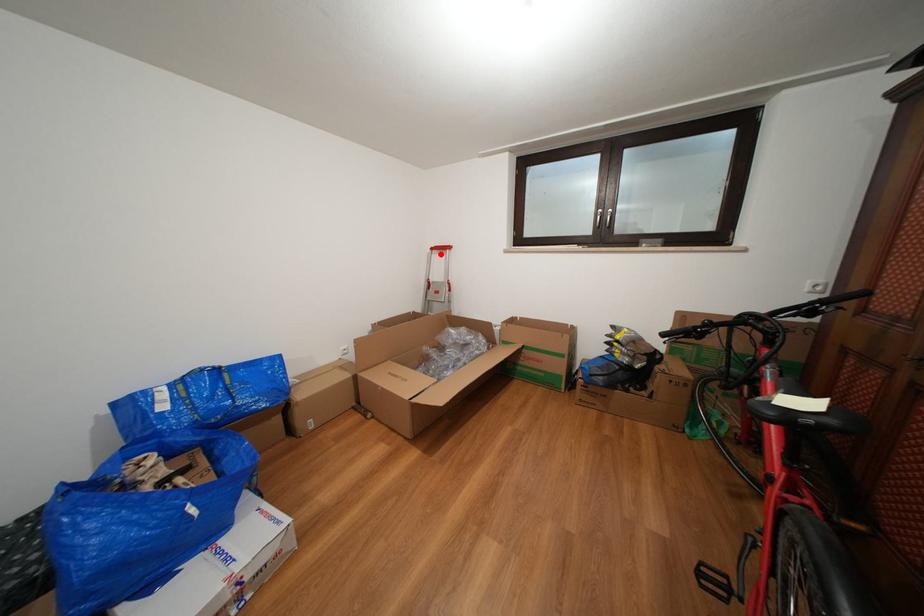
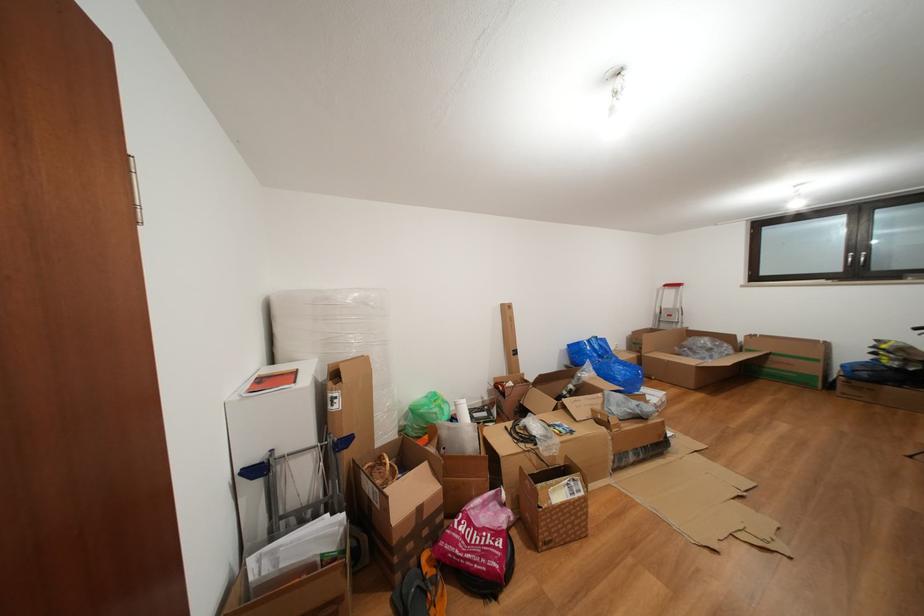
Question: I am providing you with two images of the same scene from different viewpoints. In image1, a red point is highlighted. Considering the same 3D point in image2, which of the following is correct?

Choices:
 (A) It is closer
 (B) It is farther

Answer: (B)